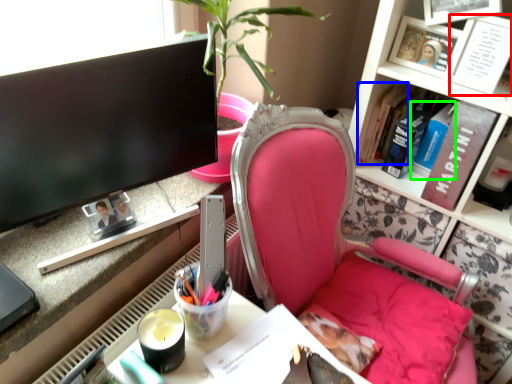
Question: Which object is positioned farthest from book (highlighted by a red box)? Select from book (highlighted by a blue box) and book (highlighted by a green box).

Choices:
 (A) book
 (B) book

Answer: (A)